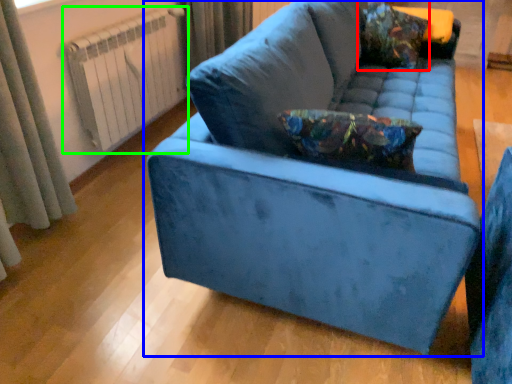
Question: Considering the real-world distances, which object is farthest from throw pillow (highlighted by a red box)? studio couch (highlighted by a blue box) or radiator (highlighted by a green box)?

Choices:
 (A) studio couch
 (B) radiator

Answer: (B)